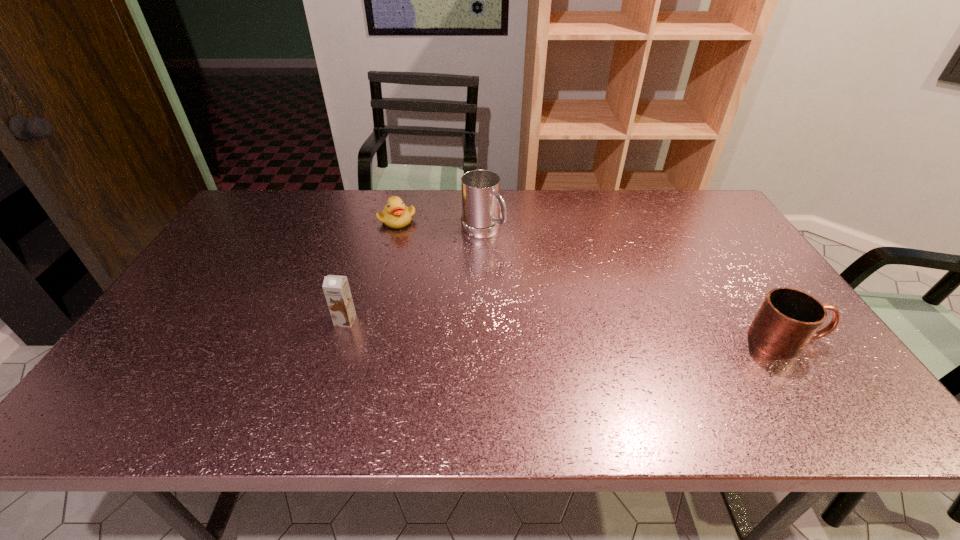
This screenshot has height=540, width=960. I want to click on free spot between the duckling and the chocolate milk, so click(x=372, y=270).

You are a GUI agent. You are given a task and a screenshot of the screen. Output one action in this format:
    pyautogui.click(x=<x>, y=<y>)
    Task: Click on the vacant point located between the chocolate milk and the second shortest object
    
    Given the screenshot: What is the action you would take?
    pyautogui.click(x=566, y=330)

What are the coordinates of `vacant point located between the tallest object and the third shortest object` in the screenshot? It's located at (414, 275).

Identify the location of free space between the left mug and the third shortest object. The image size is (960, 540). (414, 275).

Where is `blank region between the duckling and the chocolate milk`? Image resolution: width=960 pixels, height=540 pixels. blank region between the duckling and the chocolate milk is located at coordinates (372, 270).

Select which object appears as the second closest to the chocolate milk. Please provide its 2D coordinates. Your answer should be formatted as a tuple, i.e. [(x, y)], where the tuple contains the x and y coordinates of a point satisfying the conditions above.

[(480, 189)]

Identify which object is located as the second nearest to the rightmost object. Please provide its 2D coordinates. Your answer should be formatted as a tuple, i.e. [(x, y)], where the tuple contains the x and y coordinates of a point satisfying the conditions above.

[(395, 214)]

Identify the location of vacant space that satisfies the following two spatial constraints: 1. on the front side of the rightmost object; 2. on the side of the duckling with the handle. This screenshot has width=960, height=540. (367, 340).

Where is `free region that satisfies the following two spatial constraints: 1. on the front side of the left mug; 2. on the left side of the shortest object`? This screenshot has height=540, width=960. free region that satisfies the following two spatial constraints: 1. on the front side of the left mug; 2. on the left side of the shortest object is located at coordinates [x=395, y=230].

You are a GUI agent. You are given a task and a screenshot of the screen. Output one action in this format:
    pyautogui.click(x=<x>, y=<y>)
    Task: Click on the free space that satisfies the following two spatial constraints: 1. on the back side of the duckling; 2. on the left side of the chocolate milk
    
    Given the screenshot: What is the action you would take?
    pyautogui.click(x=377, y=220)